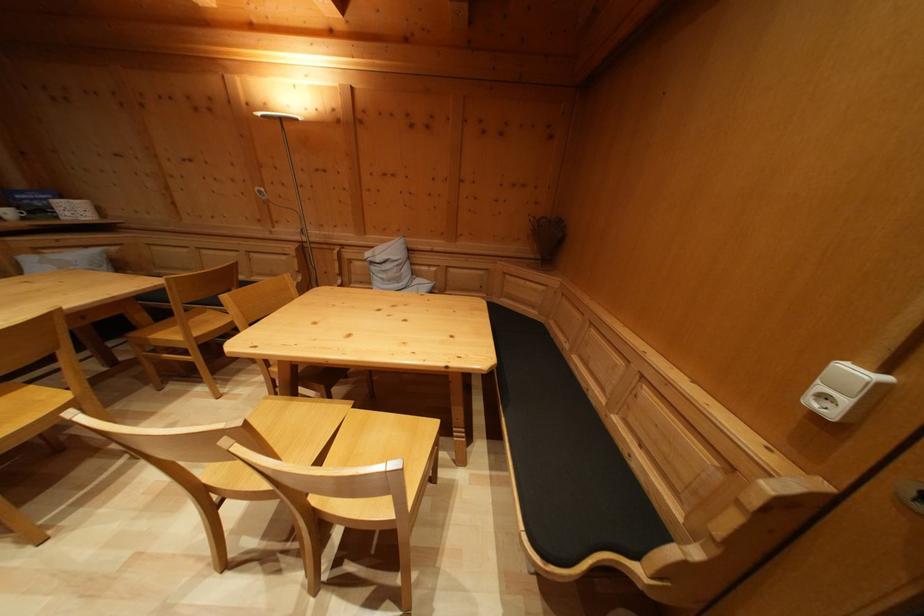
Where is `bench sitting surface`? Image resolution: width=924 pixels, height=616 pixels. bench sitting surface is located at coordinates tap(576, 487).